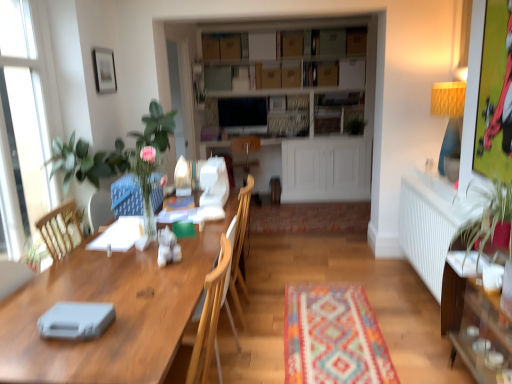
What do you see at coordinates (333, 337) in the screenshot? The width and height of the screenshot is (512, 384). I see `multicolored woven mat at center` at bounding box center [333, 337].

What is the approximate height of white glass window at left?

white glass window at left is 5.28 feet tall.

Locate an element on the screen. black glossy television at upper center is located at coordinates (243, 115).

The image size is (512, 384). What do you see at coordinates (243, 115) in the screenshot?
I see `black glossy television at upper center` at bounding box center [243, 115].

Where is `wooden table at center`? wooden table at center is located at coordinates (116, 313).

In order to click on wooden cabinet at right in this screenshot , I will do `click(475, 321)`.

This screenshot has width=512, height=384. Find the location of `multicolored woven mat at center`. multicolored woven mat at center is located at coordinates (333, 337).

Is wooden cabinet at right turned away from black glossy television at upper center?

That's not correct — wooden cabinet at right is not looking away from black glossy television at upper center.

Does point (494, 364) come farther from viewer compared to point (247, 115)?

No, it is in front of (247, 115).

Which object is further away from the camera taking this photo, wooden cabinet at right or black glossy television at upper center?

black glossy television at upper center.

From the picture: From a real-world perspective, who is located lower, wooden cabinet at right or black glossy television at upper center?

wooden cabinet at right.

From the image's perspective, is wooden chair at center located above or below wooden cabinet at right?

From the image's perspective, wooden chair at center appears above wooden cabinet at right.

Does wooden chair at center have a smaller size compared to wooden cabinet at right?

Incorrect, wooden chair at center is not smaller in size than wooden cabinet at right.

Considering the relative sizes of wooden chair at center and wooden cabinet at right in the image provided, is wooden chair at center taller than wooden cabinet at right?

Correct, wooden chair at center is much taller as wooden cabinet at right.

Which point is more forward, [471,265] or [24,356]?

The point [24,356] is closer to the camera.

Is there a large distance between wooden cabinet at right and wooden table at center?

wooden cabinet at right is far away from wooden table at center.

Is wooden cabinet at right wider than wooden table at center?

No, wooden cabinet at right is not wider than wooden table at center.

Is wooden cabinet at right to the left of wooden table at center from the viewer's perspective?

No, wooden cabinet at right is not to the left of wooden table at center.

Is wooden table at center further to the viewer compared to blue fabric swivel chair at left?

No, it is not.

You are a GUI agent. You are given a task and a screenshot of the screen. Output one action in this format:
    pyautogui.click(x=<x>, y=<y>)
    Task: Click on the swivel chair lying above the wooden table at center (from the image's perspective)
    
    Given the screenshot: What is the action you would take?
    pyautogui.click(x=127, y=197)

What's the angular difference between wooden table at center and blue fabric swivel chair at left's facing directions?

There is a 5.22-degree angle between the facing directions of wooden table at center and blue fabric swivel chair at left.

Based on the photo, how much distance is there between wooden table at center and blue fabric swivel chair at left?

wooden table at center and blue fabric swivel chair at left are 26.90 inches apart from each other.

From a real-world perspective, who is located lower, cardboard boxes at center or wooden cabinet at right?

wooden cabinet at right is physically lower.

Could wooden cabinet at right be considered to be inside cardboard boxes at center?

No.

Is cardboard boxes at center to the left or to the right of wooden cabinet at right in the image?

Based on their positions, cardboard boxes at center is located to the left of wooden cabinet at right.

Is matte black picture frame at upper left not near white radiator at right?

Yes, matte black picture frame at upper left and white radiator at right are located far from each other.

Is matte black picture frame at upper left aimed at white radiator at right?

No, matte black picture frame at upper left is not aimed at white radiator at right.

In the image, is matte black picture frame at upper left positioned in front of or behind white radiator at right?

Visually, matte black picture frame at upper left is located behind white radiator at right.

Is matte black picture frame at upper left taller than white radiator at right?

No.

How many degrees apart are the facing directions of multicolored woven mat at center and white radiator at right?

There is a 179-degree angle between the facing directions of multicolored woven mat at center and white radiator at right.

From the image's perspective, between multicolored woven mat at center and white radiator at right, who is located below?

multicolored woven mat at center is shown below in the image.

This screenshot has width=512, height=384. Find the location of `mat below the white radiator at right (from the image's perspective)`. mat below the white radiator at right (from the image's perspective) is located at coordinates (333, 337).

Which object is further away from the camera taking this photo, multicolored woven mat at center or white radiator at right?

Positioned behind is multicolored woven mat at center.

In order to click on cabinetry below the black glossy television at upper center (from the image's perspective) in this screenshot , I will do `click(475, 321)`.

This screenshot has width=512, height=384. Identify the location of chair behind the wooden cabinet at right. (208, 317).

Which object lies further to the anchor point wooden chair at center, wooden cabinet at right or multicolored woven mat at center?

The object further to wooden chair at center is wooden cabinet at right.

From the image, which object appears to be farther from multicolored woven mat at center, black glossy television at upper center or wooden cabinet at right?

black glossy television at upper center.

Looking at the image, which one is located further to black glossy television at upper center, wooden armchair at center or blue fabric swivel chair at left?

blue fabric swivel chair at left is positioned further to the anchor black glossy television at upper center.

Considering their positions, is white glass window at left positioned closer to wooden table at center than wooden chair at center?

wooden chair at center is positioned closer to the anchor wooden table at center.

Based on their spatial positions, is wooden cabinet at right or wooden table at center closer to blue fabric swivel chair at left?

wooden table at center is positioned closer to the anchor blue fabric swivel chair at left.

Considering their positions, is cardboard boxes at center positioned further to blue fabric swivel chair at left than black glossy television at upper center?

cardboard boxes at center is further to blue fabric swivel chair at left.

Looking at the image, which one is located closer to wooden armchair at center, cardboard boxes at center or wooden chair at center?

wooden chair at center is closer to wooden armchair at center.

Estimate the real-world distances between objects in this image. Which object is closer to white glass window at left, cardboard boxes at center or wooden table at center?

wooden table at center is positioned closer to the anchor white glass window at left.

Find the location of a particular element. armchair located between wooden table at center and blue fabric swivel chair at left in the depth direction is located at coordinates (240, 245).

Locate an element on the screen. The height and width of the screenshot is (384, 512). armchair located between matte black picture frame at upper left and white radiator at right in the left-right direction is located at coordinates (240, 245).

You are a GUI agent. You are given a task and a screenshot of the screen. Output one action in this format:
    pyautogui.click(x=<x>, y=<y>)
    Task: Click on the window between matte black picture frame at upper left and wooden chair at center from top to bottom
    Image resolution: width=512 pixels, height=384 pixels.
    Given the screenshot: What is the action you would take?
    pyautogui.click(x=30, y=103)

You are a GUI agent. You are given a task and a screenshot of the screen. Output one action in this format:
    pyautogui.click(x=<x>, y=<y>)
    Task: Click on the radiator located between blue fabric swivel chair at left and wooden cabinet at right in the left-right direction
    The width and height of the screenshot is (512, 384).
    Given the screenshot: What is the action you would take?
    pyautogui.click(x=431, y=222)